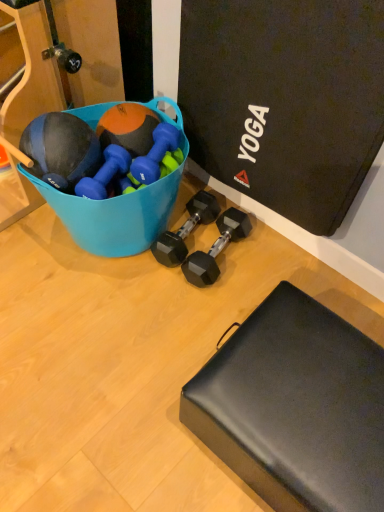
Find the location of `free location to the right of black rubber dumbbell at center, marked as the first dumbbell in a right-to-left arrangement`. free location to the right of black rubber dumbbell at center, marked as the first dumbbell in a right-to-left arrangement is located at coordinates (272, 259).